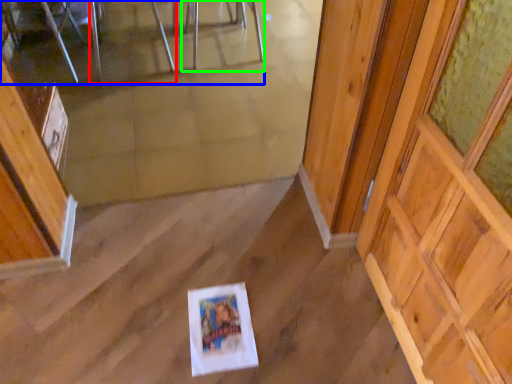
Question: Which object is positioned closest to chair (highlighted by a red box)? Select from furniture (highlighted by a blue box) and chair (highlighted by a green box).

Choices:
 (A) furniture
 (B) chair

Answer: (A)